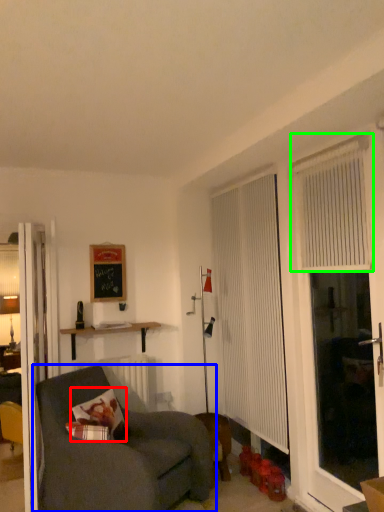
Question: Estimate the real-world distances between objects in this image. Which object is closer to pillow (highlighted by a red box), studio couch (highlighted by a blue box) or curtain (highlighted by a green box)?

Choices:
 (A) studio couch
 (B) curtain

Answer: (A)